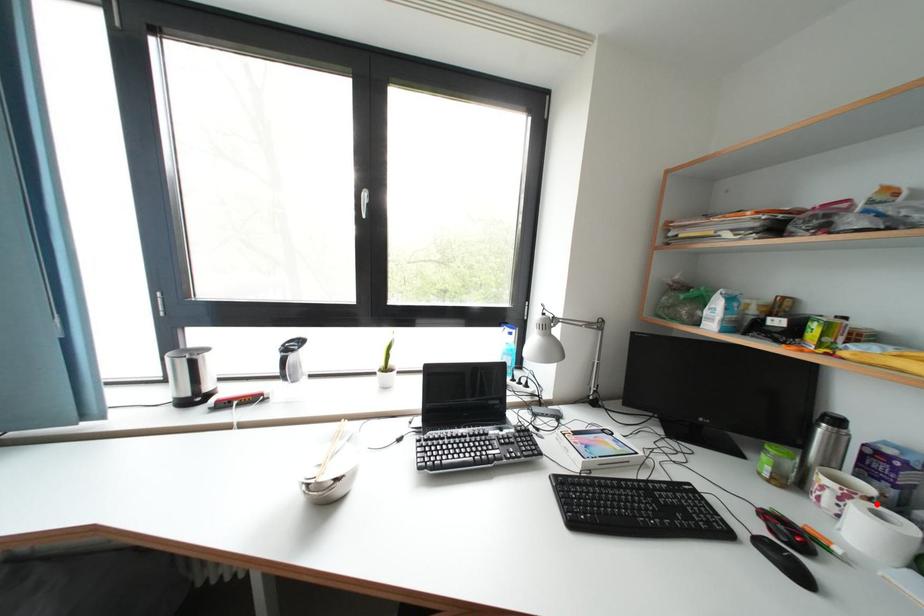
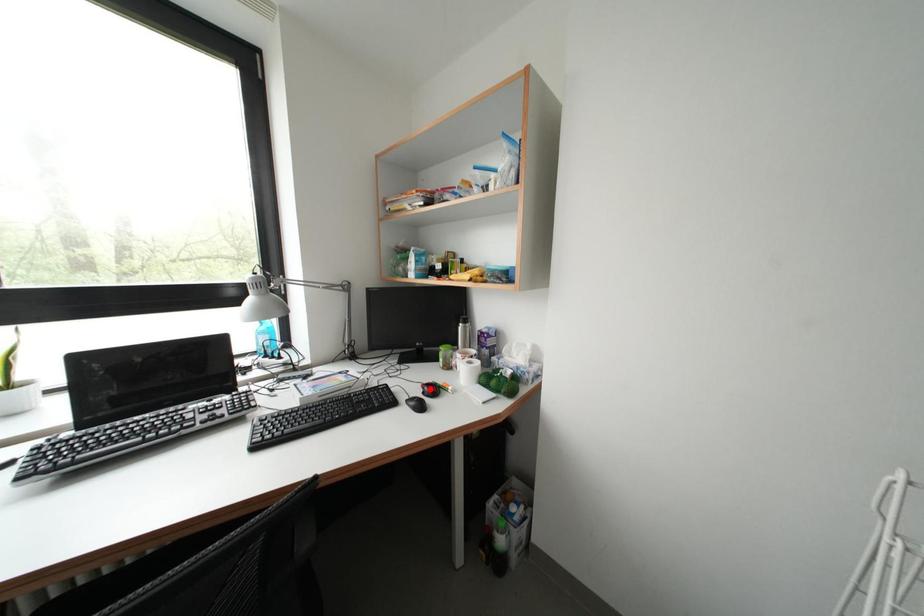
I am providing you with two images of the same scene from different viewpoints. A red point is marked on the first image and another point is marked on the second image. Do the highlighted points in image1 and image2 indicate the same real-world spot?

No